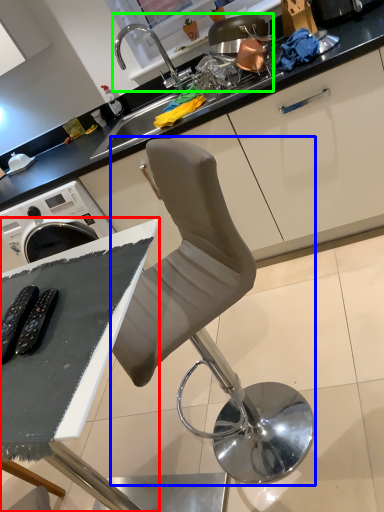
Question: Which is nearer to the table (highlighted by a red box)? chair (highlighted by a blue box) or sink (highlighted by a green box).

Choices:
 (A) chair
 (B) sink

Answer: (A)